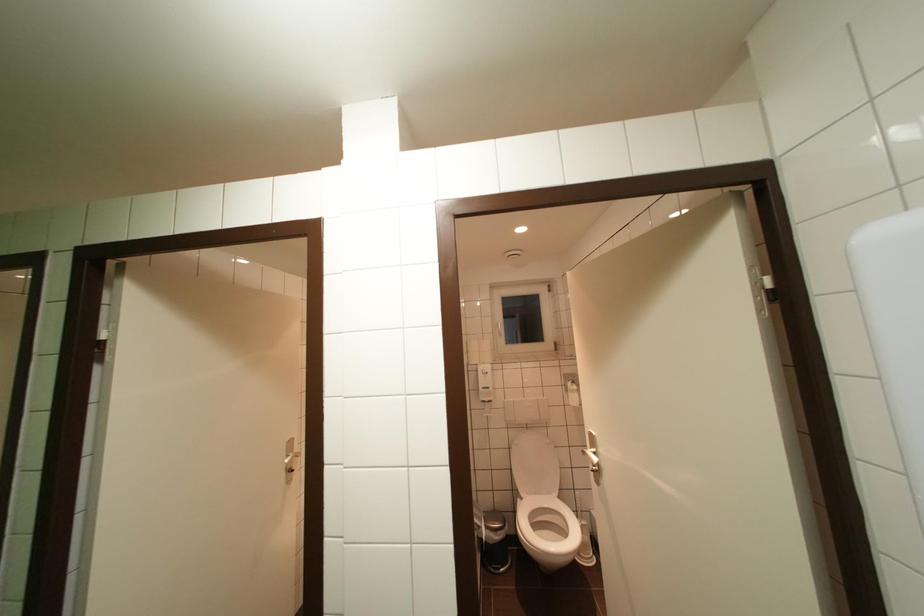
Find where to press the trash can pedal. Please return your answer as a coordinate pair (x, y).

(492, 525)